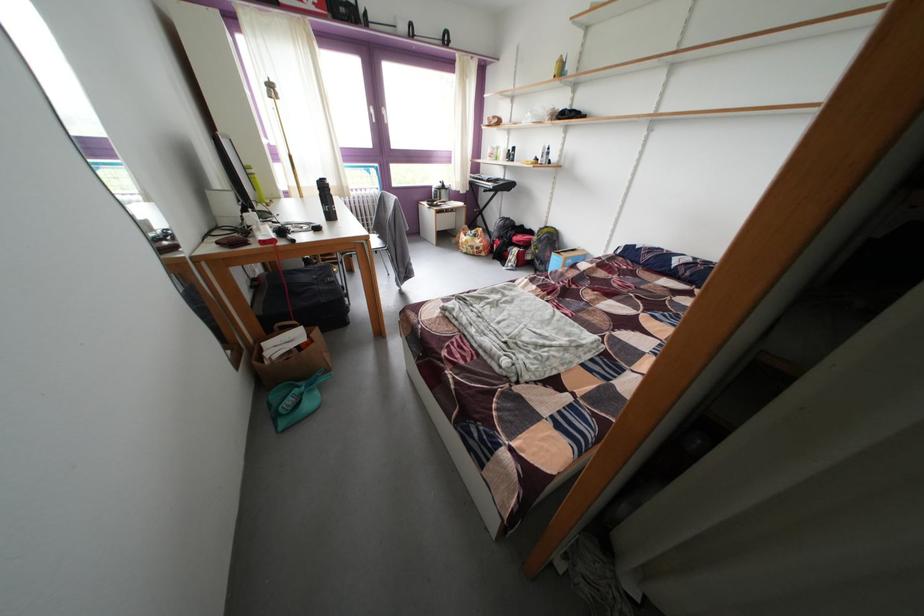
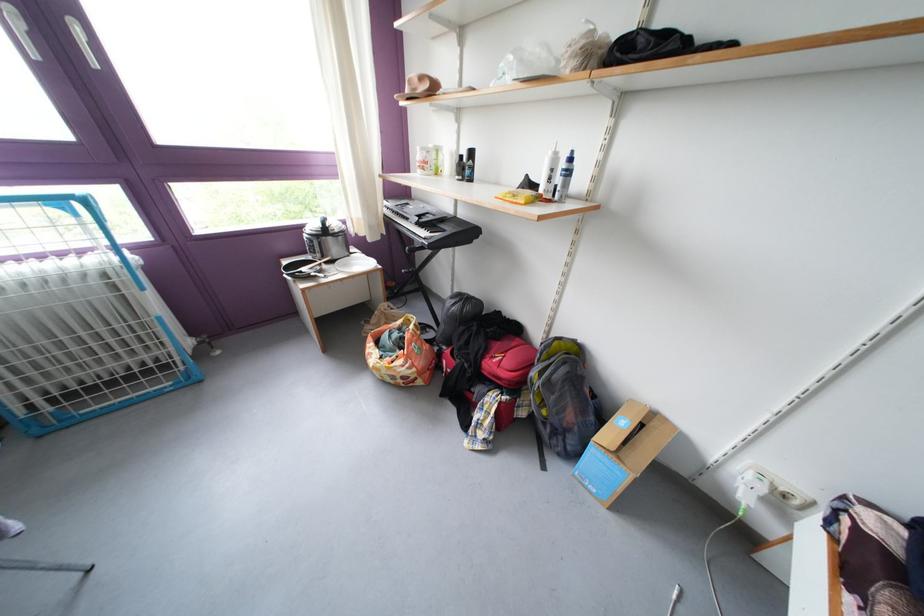
The point at (499, 187) is marked in the first image. Where is the corresponding point in the second image?

(430, 229)